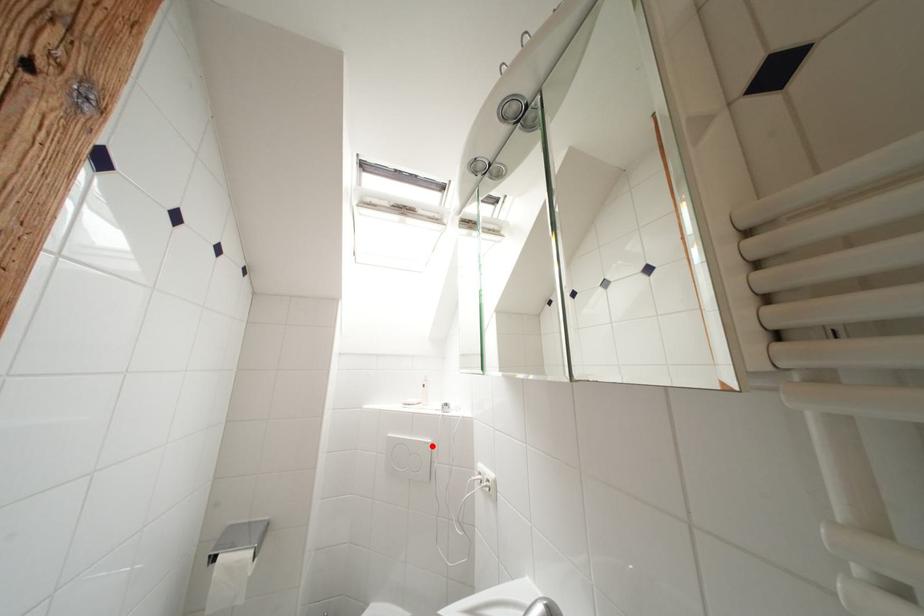
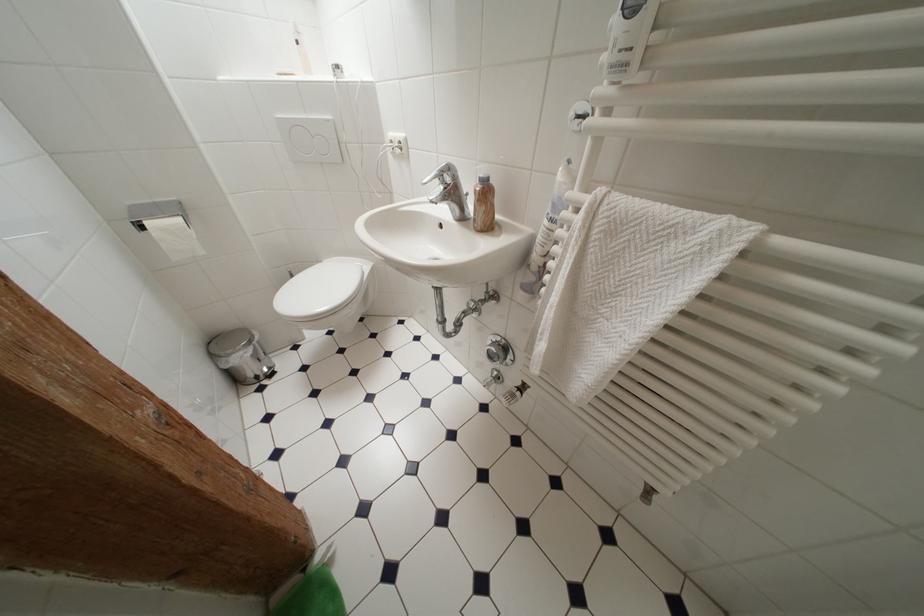
Question: I am providing you with two images of the same scene from different viewpoints. Given a red point in image1, look at the same physical point in image2. Is it:

Choices:
 (A) Closer to the viewpoint
 (B) Farther from the viewpoint

Answer: (A)